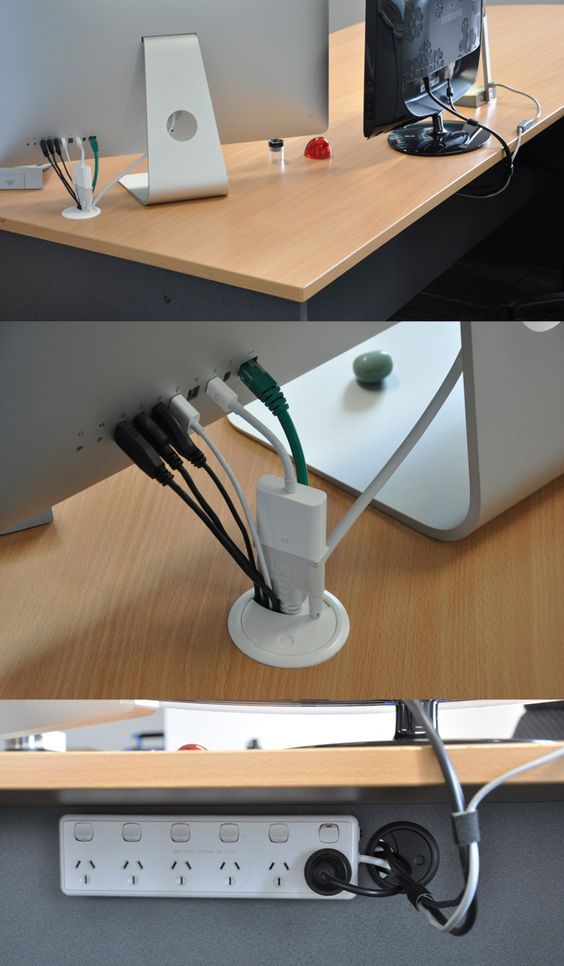
Where is `outlets`? Image resolution: width=564 pixels, height=966 pixels. outlets is located at coordinates (92, 870), (122, 873), (164, 877), (241, 881), (281, 882).